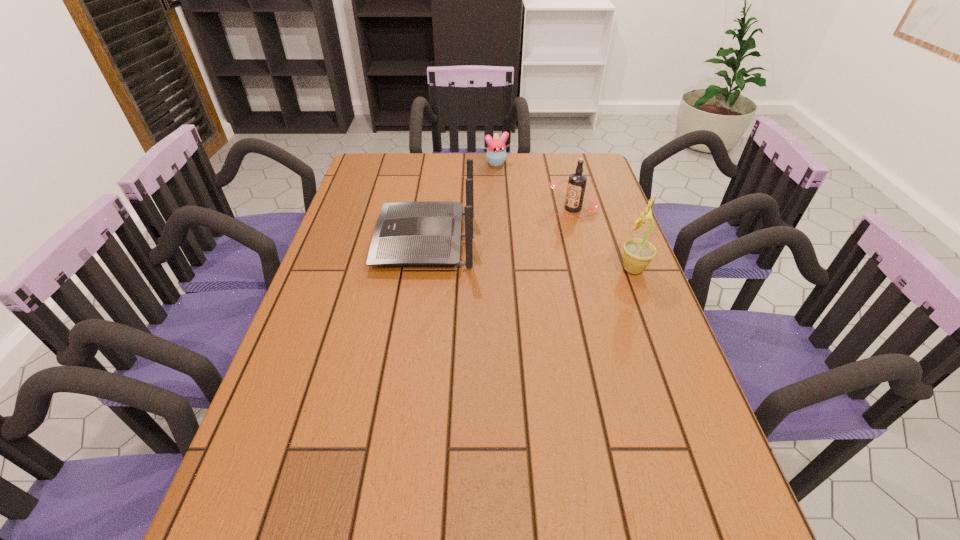
This screenshot has height=540, width=960. Find the location of `vacant area between the root beer and the shortest object`. vacant area between the root beer and the shortest object is located at coordinates (535, 186).

Find the location of a particular element. free area in between the sunflower and the router is located at coordinates (529, 255).

Locate an element on the screen. This screenshot has width=960, height=540. vacant area between the leftmost object and the root beer is located at coordinates (498, 225).

Identify the location of free area in between the sunflower and the second shortest object. The width and height of the screenshot is (960, 540). (603, 239).

What are the coordinates of `free area in between the root beer and the sunflower` in the screenshot? It's located at (603, 239).

Where is `free area in between the cupcake and the leftmost object`? free area in between the cupcake and the leftmost object is located at coordinates (461, 202).

Locate an element on the screen. The image size is (960, 540). object that is the third closest one to the root beer is located at coordinates (424, 233).

What are the coordinates of `the closest object to the router` in the screenshot? It's located at (577, 181).

The image size is (960, 540). I want to click on vacant point that satisfies the following two spatial constraints: 1. on the front side of the shortest object; 2. on the face of the sunflower, so click(x=503, y=269).

This screenshot has height=540, width=960. I want to click on free region that satisfies the following two spatial constraints: 1. on the front side of the sunflower; 2. on the face of the root beer, so click(x=588, y=269).